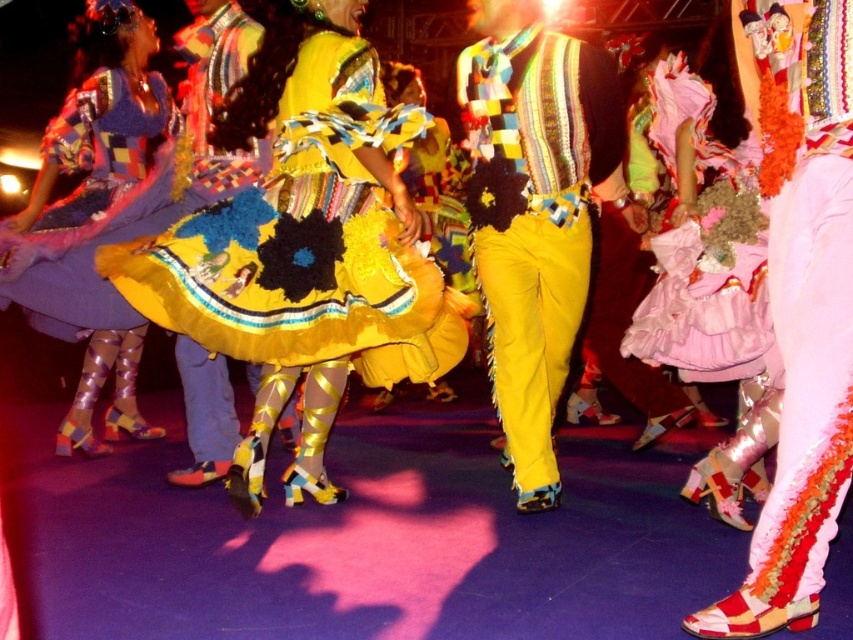
Question: Considering the relative positions of yellow textured fabric dress at center and yellow textured pants at center in the image provided, where is yellow textured fabric dress at center located with respect to yellow textured pants at center?

Choices:
 (A) above
 (B) below

Answer: (A)

Question: Can you confirm if yellow textured fabric dress at center is positioned to the right of yellow textured pants at center?

Choices:
 (A) no
 (B) yes

Answer: (A)

Question: Is yellow textured pants at center positioned in front of shiny metallic boots at lower left?

Choices:
 (A) no
 (B) yes

Answer: (B)

Question: Which object is positioned farthest from the yellow textured fabric dress at center?

Choices:
 (A) yellow textured pants at center
 (B) shiny metallic boots at lower left

Answer: (B)

Question: Which point appears closest to the camera in this image?

Choices:
 (A) (345, 96)
 (B) (3, 262)

Answer: (A)

Question: Which object appears farthest from the camera in this image?

Choices:
 (A) yellow textured pants at center
 (B) yellow textured fabric dress at center

Answer: (A)